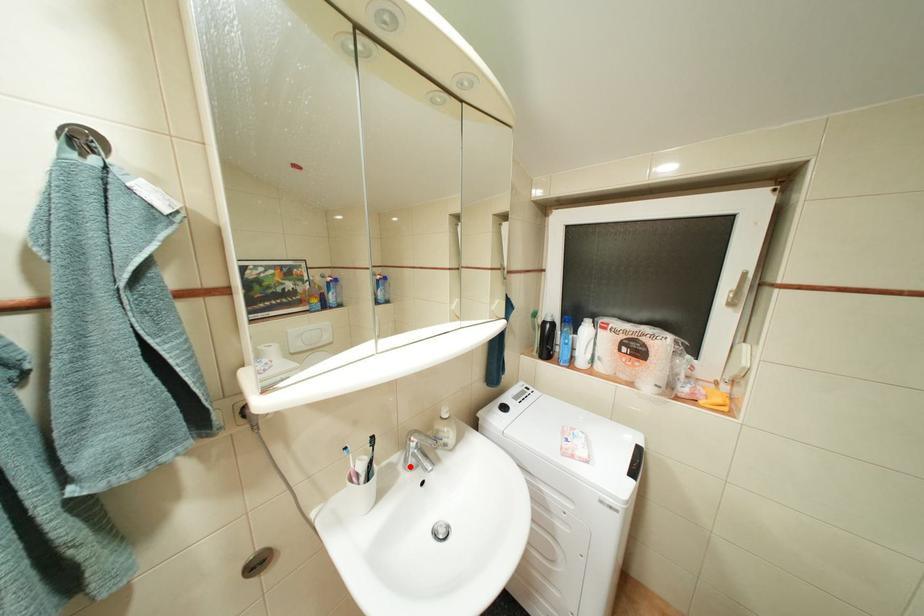
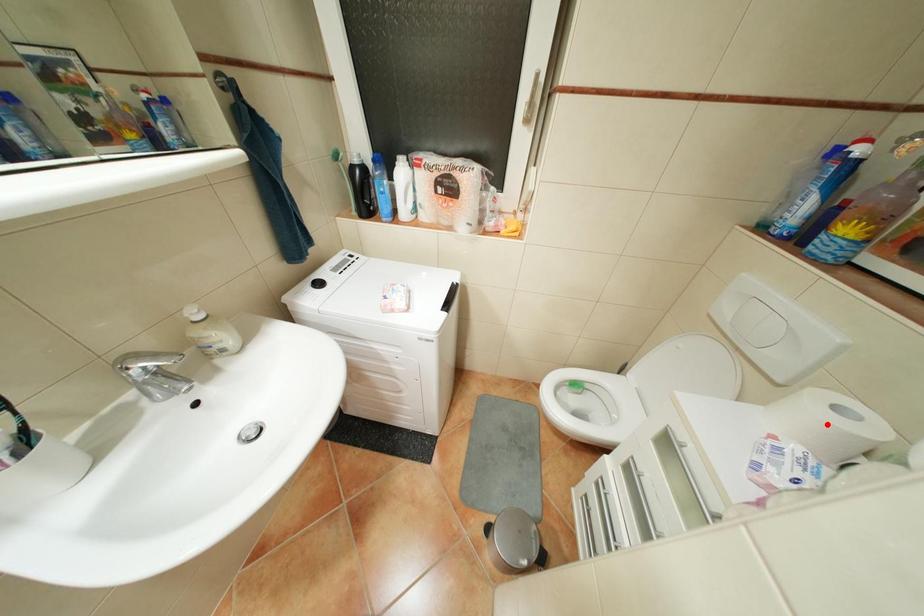
I am providing you with two images of the same scene from different viewpoints. A red point is marked on the first image and another point is marked on the second image. Do the highlighted points in image1 and image2 indicate the same real-world spot?

No